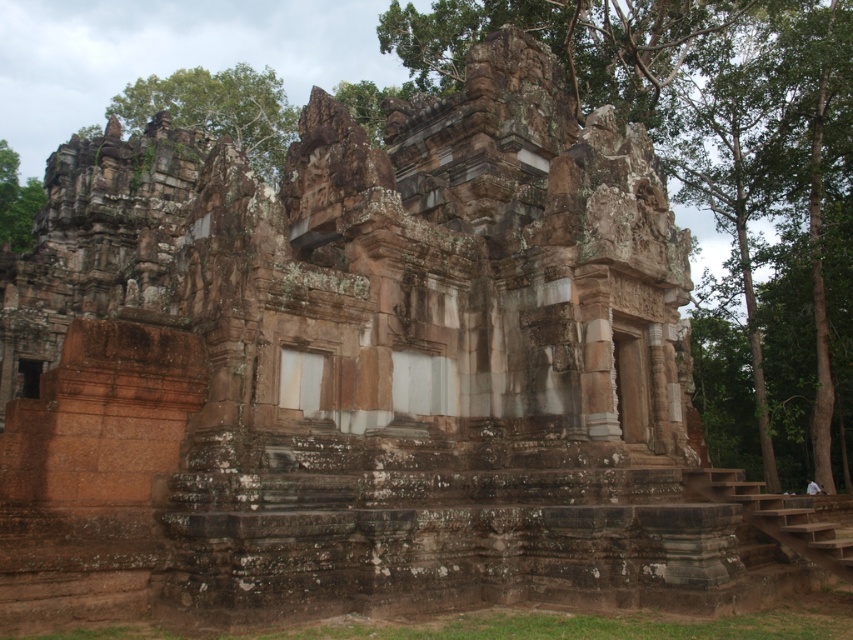
Does green leafy tree at upper left have a larger size compared to green mossy tree at upper left?

Correct, green leafy tree at upper left is larger in size than green mossy tree at upper left.

Between point (189, 70) and point (3, 202), which one is positioned in front?

Point (3, 202)

Does point (161, 88) come behind point (3, 150)?

No, (161, 88) is closer to viewer.

The height and width of the screenshot is (640, 853). Find the location of `green leafy tree at upper left`. green leafy tree at upper left is located at coordinates (218, 109).

Does green mossy stone temple at center have a greater height compared to green leafy tree at upper left?

Correct, green mossy stone temple at center is much taller as green leafy tree at upper left.

Is point (844, 289) farther from viewer compared to point (285, 93)?

No, (844, 289) is in front of (285, 93).

Where is `green mossy stone temple at center`? This screenshot has height=640, width=853. green mossy stone temple at center is located at coordinates (718, 186).

Can you confirm if green mossy stone temple at center is bigger than green mossy tree at upper left?

Yes, green mossy stone temple at center is bigger than green mossy tree at upper left.

Does green mossy stone temple at center appear on the right side of green mossy tree at upper left?

Indeed, green mossy stone temple at center is positioned on the right side of green mossy tree at upper left.

Find the location of a particular element. green mossy stone temple at center is located at coordinates (718, 186).

Locate an element on the screen. This screenshot has width=853, height=640. green mossy stone temple at center is located at coordinates (718, 186).